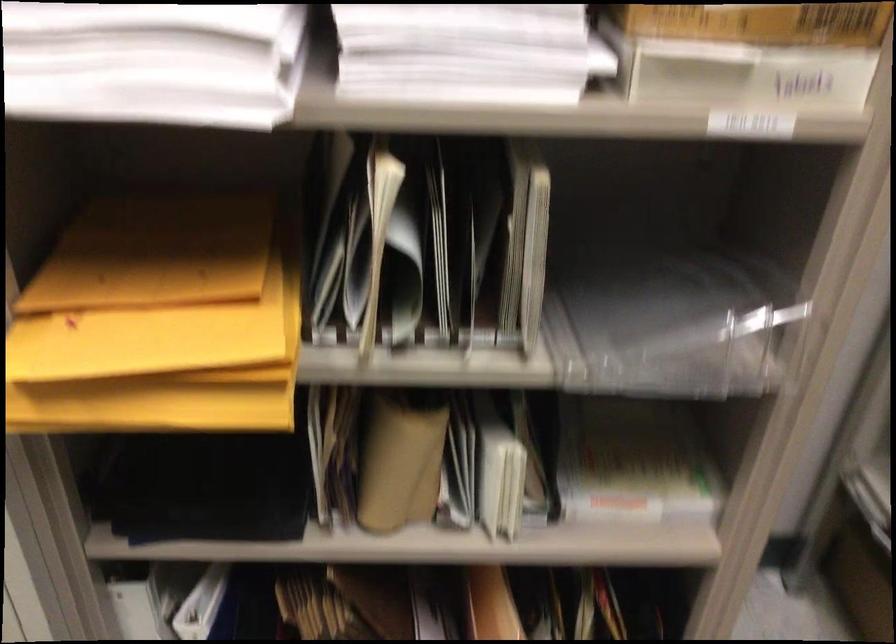
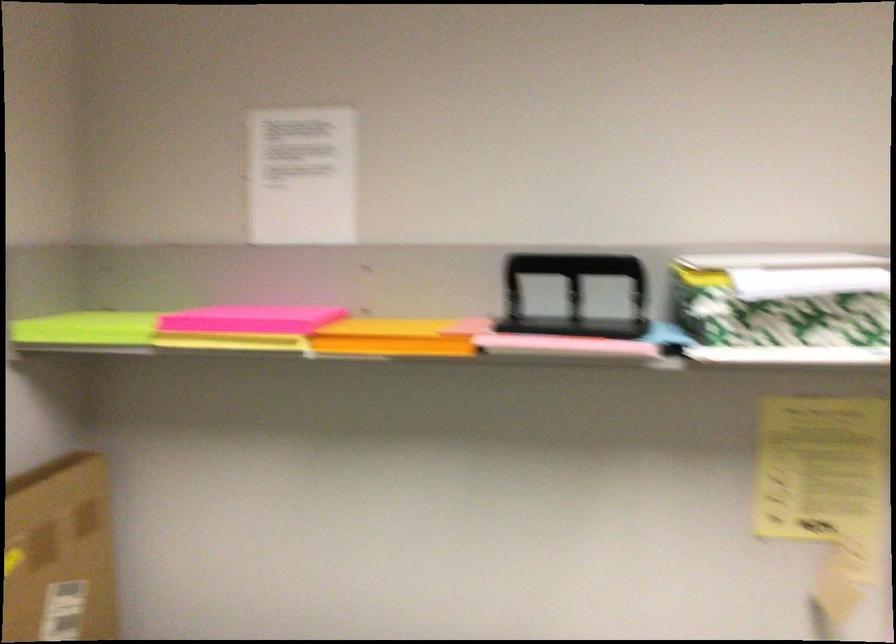
Question: What movement of the cameraman would produce the second image?

Choices:
 (A) Left
 (B) Right
 (C) Forward
 (D) Backward

Answer: (D)